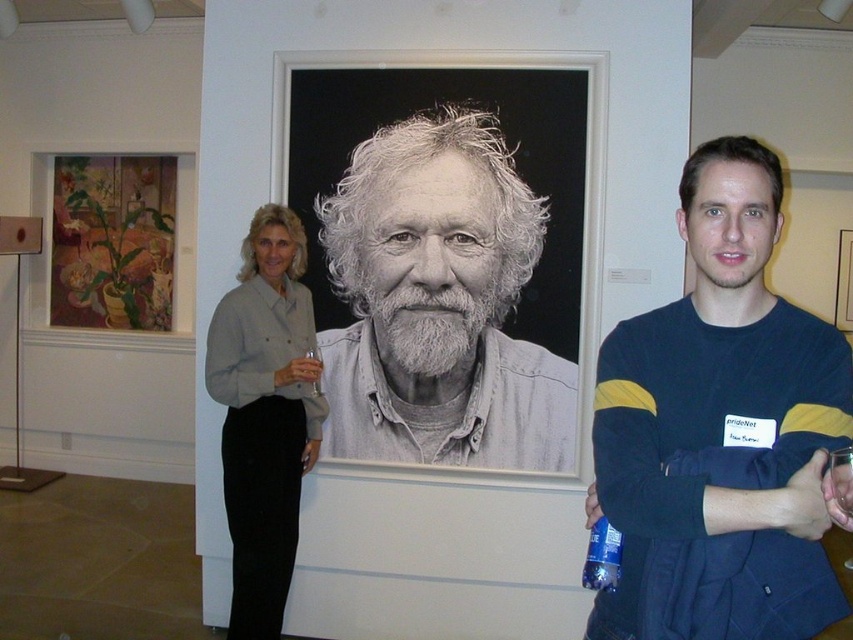
Is dark blue sweater at right closer to the viewer compared to gray matte portrait at center?

Yes.

Can you confirm if dark blue sweater at right is positioned to the right of gray matte portrait at center?

Indeed, dark blue sweater at right is positioned on the right side of gray matte portrait at center.

Between point (846, 401) and point (495, 448), which one is positioned in front?

Point (846, 401) is more forward.

The image size is (853, 640). In order to click on dark blue sweater at right in this screenshot , I will do `click(720, 432)`.

Measure the distance between dark blue sweater at right and blue plastic bottle at center.

A distance of 10.41 inches exists between dark blue sweater at right and blue plastic bottle at center.

Consider the image. Does dark blue sweater at right have a greater width compared to blue plastic bottle at center?

Indeed, dark blue sweater at right has a greater width compared to blue plastic bottle at center.

Locate an element on the screen. dark blue sweater at right is located at coordinates (720, 432).

This screenshot has width=853, height=640. What do you see at coordinates (265, 413) in the screenshot?
I see `light gray shirt at center` at bounding box center [265, 413].

Is light gray shirt at center positioned behind floral painting at upper left?

No.

Between point (287, 557) and point (55, 198), which one is positioned in front?

Point (287, 557)

Identify the location of light gray shirt at center. Image resolution: width=853 pixels, height=640 pixels. (265, 413).